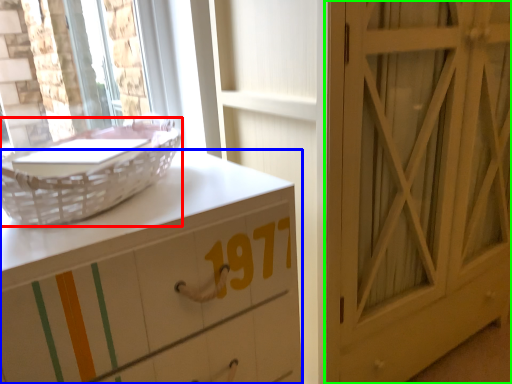
Question: Based on their relative distances, which object is nearer to basket (highlighted by a red box)? Choose from chest of drawers (highlighted by a blue box) and door (highlighted by a green box).

Choices:
 (A) chest of drawers
 (B) door

Answer: (A)